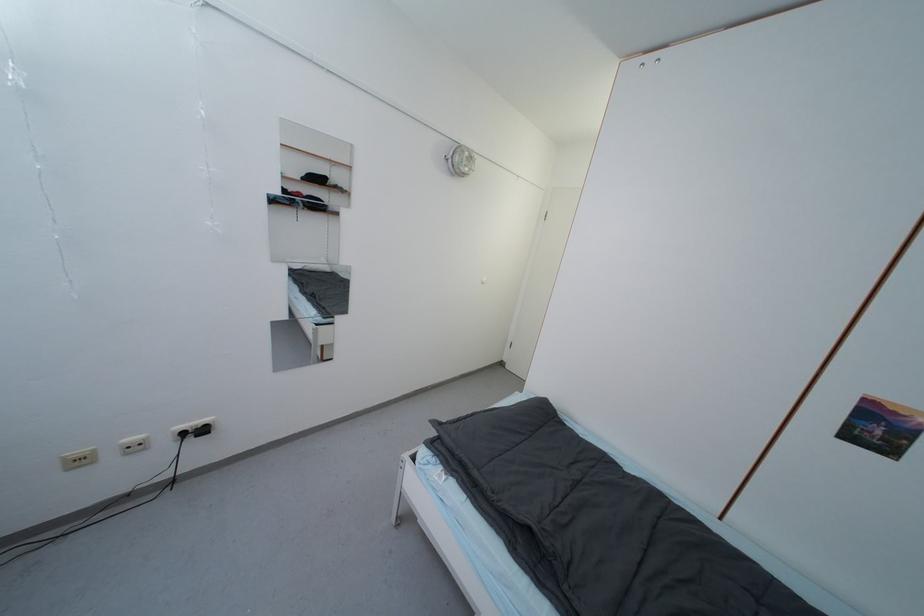
Locate an element on the screen. This screenshot has height=616, width=924. cabinet finger pull is located at coordinates (640, 63).